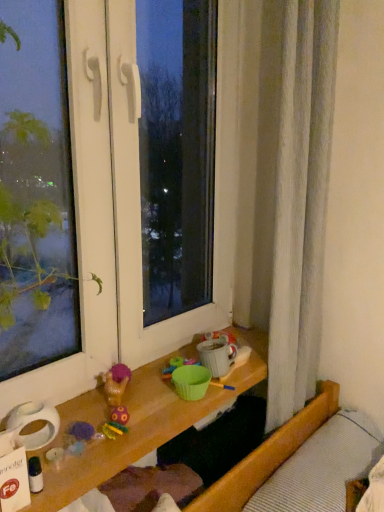
Question: Can you confirm if translucent plastic bottle at lower left, the first toy when ordered from bottom to top, is positioned to the left of white textured bed at lower right?

Choices:
 (A) no
 (B) yes

Answer: (B)

Question: Does translucent plastic bottle at lower left, marked as the 1th toy in a left-to-right arrangement, have a greater width compared to white textured bed at lower right?

Choices:
 (A) yes
 (B) no

Answer: (B)

Question: Is translucent plastic bottle at lower left, the second toy from the right, behind white textured bed at lower right?

Choices:
 (A) no
 (B) yes

Answer: (A)

Question: Is translucent plastic bottle at lower left, the first toy when ordered from bottom to top, shorter than white textured bed at lower right?

Choices:
 (A) yes
 (B) no

Answer: (A)

Question: Is translucent plastic bottle at lower left, positioned as the 2th toy in top-to-bottom order, aimed at white textured bed at lower right?

Choices:
 (A) yes
 (B) no

Answer: (B)

Question: Looking at the image, does plush purple toy at lower left, positioned as the second toy in front-to-back order, seem bigger or smaller compared to transparent glass window at center?

Choices:
 (A) small
 (B) big

Answer: (A)

Question: Would you say plush purple toy at lower left, which is the 1th toy in back-to-front order, is to the left or to the right of transparent glass window at center in the picture?

Choices:
 (A) left
 (B) right

Answer: (B)

Question: From their relative heights in the image, would you say plush purple toy at lower left, positioned as the second toy in left-to-right order, is taller or shorter than transparent glass window at center?

Choices:
 (A) tall
 (B) short

Answer: (B)

Question: Considering the positions of plush purple toy at lower left, which is the 1th toy in back-to-front order, and transparent glass window at center in the image, is plush purple toy at lower left, which is the 1th toy in back-to-front order, wider or thinner than transparent glass window at center?

Choices:
 (A) thin
 (B) wide

Answer: (A)

Question: Considering the positions of point (130, 305) and point (331, 502), is point (130, 305) closer or farther from the camera than point (331, 502)?

Choices:
 (A) closer
 (B) farther

Answer: (B)

Question: Looking at their shapes, would you say transparent glass window at center is wider or thinner than white textured bed at lower right?

Choices:
 (A) thin
 (B) wide

Answer: (B)

Question: Considering the relative positions of transparent glass window at center and white textured bed at lower right in the image provided, is transparent glass window at center to the left or to the right of white textured bed at lower right?

Choices:
 (A) right
 (B) left

Answer: (B)

Question: From a real-world perspective, is transparent glass window at center positioned above or below white textured bed at lower right?

Choices:
 (A) below
 (B) above

Answer: (B)

Question: Is point (339, 502) positioned closer to the camera than point (38, 473)?

Choices:
 (A) farther
 (B) closer

Answer: (A)

Question: From a real-world perspective, is white textured bed at lower right above or below translucent plastic bottle at lower left, placed as the 1th toy when sorted from front to back?

Choices:
 (A) above
 (B) below

Answer: (B)